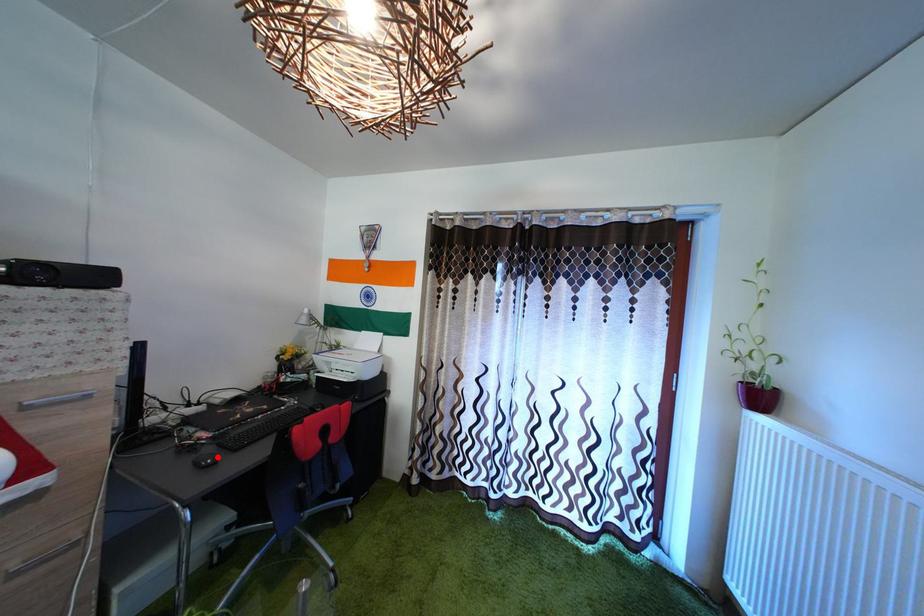
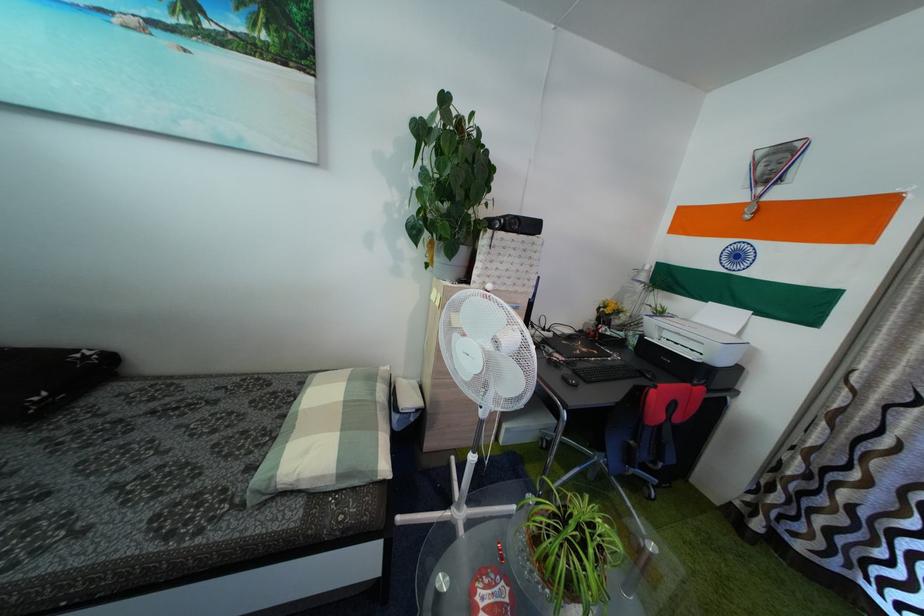
In the second image, find the point that corresponds to the highlighted location in the first image.

(575, 379)